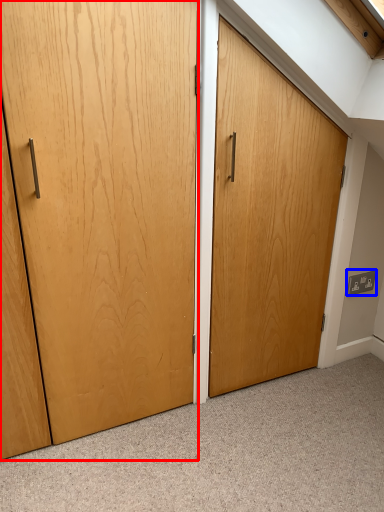
Question: Which object is closer to the camera taking this photo, door (highlighted by a red box) or electric outlet (highlighted by a blue box)?

Choices:
 (A) door
 (B) electric outlet

Answer: (A)